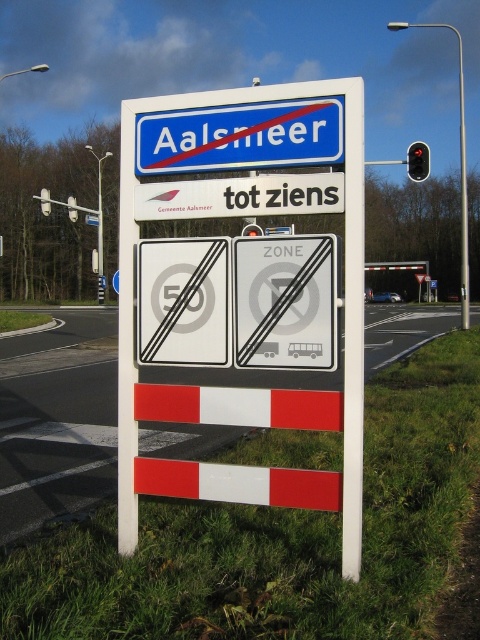
Is green grass at lower center bigger than metallic silver bus at center?

Correct, green grass at lower center is larger in size than metallic silver bus at center.

Is green grass at lower center further to camera compared to metallic silver bus at center?

No, green grass at lower center is closer to the viewer.

Describe the element at coordinates (276, 538) in the screenshot. The height and width of the screenshot is (640, 480). I see `green grass at lower center` at that location.

Identify the location of green grass at lower center. This screenshot has width=480, height=640. point(276,538).

Describe the element at coordinates (345, 276) in the screenshot. The width and height of the screenshot is (480, 640). I see `white plastic sign at center` at that location.

This screenshot has height=640, width=480. Identify the location of white plastic sign at center. (345, 276).

Between green grass at lower center and white plastic speed limit sign at upper center, which one has less height?

green grass at lower center is shorter.

Who is positioned more to the right, green grass at lower center or white plastic speed limit sign at upper center?

Positioned to the right is green grass at lower center.

Who is more distant from viewer, (213, 564) or (91, 224)?

The point (91, 224) is more distant.

Locate an element on the screen. The width and height of the screenshot is (480, 640). green grass at lower center is located at coordinates (276, 538).